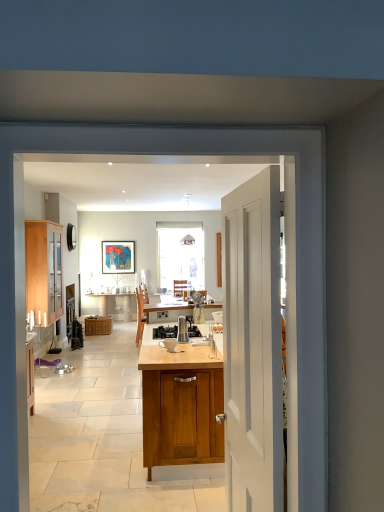
This screenshot has height=512, width=384. What do you see at coordinates (187, 226) in the screenshot?
I see `metallic pendant light at upper center` at bounding box center [187, 226].

The height and width of the screenshot is (512, 384). What do you see at coordinates (44, 271) in the screenshot? I see `light wood/glass cabinet at left` at bounding box center [44, 271].

The width and height of the screenshot is (384, 512). What are the coordinates of `woven brown picnic basket at center` in the screenshot? It's located at (98, 325).

The height and width of the screenshot is (512, 384). Describe the element at coordinates (98, 325) in the screenshot. I see `woven brown picnic basket at center` at that location.

The image size is (384, 512). What do you see at coordinates (182, 330) in the screenshot?
I see `satin silver coffee maker at center` at bounding box center [182, 330].

Describe the element at coordinates (165, 332) in the screenshot. I see `stainless steel gas stove at center` at that location.

The height and width of the screenshot is (512, 384). Identify the location of metallic pendant light at upper center. [x=187, y=226].

Is woven brown picnic basket at center positioned with its back to metallic pendant light at upper center?

woven brown picnic basket at center is not turned away from metallic pendant light at upper center.

In the scene shown: From the image's perspective, which one is positioned lower, woven brown picnic basket at center or metallic pendant light at upper center?

woven brown picnic basket at center is shown below in the image.

Are woven brown picnic basket at center and metallic pendant light at upper center beside each other?

woven brown picnic basket at center is not next to metallic pendant light at upper center, and they're not touching.

Find the location of a particular element. The width and height of the screenshot is (384, 512). kitchen appliance that appears on the right of wooden cabinet at center is located at coordinates (182, 330).

Choose the correct answer: Is wooden cabinet at center inside satin silver coffee maker at center or outside it?

wooden cabinet at center is located beyond the bounds of satin silver coffee maker at center.

Measure the distance from wooden cabinet at center to satin silver coffee maker at center.

The distance of wooden cabinet at center from satin silver coffee maker at center is 9.39 feet.

Who is smaller, wooden cabinet at center or satin silver coffee maker at center?

Smaller between the two is satin silver coffee maker at center.

Considering the positions of objects woven brown picnic basket at center and satin silver coffee maker at center in the image provided, who is more to the right, woven brown picnic basket at center or satin silver coffee maker at center?

From the viewer's perspective, satin silver coffee maker at center appears more on the right side.

From the image's perspective, is woven brown picnic basket at center located above or below satin silver coffee maker at center?

woven brown picnic basket at center is below satin silver coffee maker at center.

Is woven brown picnic basket at center not close to satin silver coffee maker at center?

Indeed, woven brown picnic basket at center is not near satin silver coffee maker at center.

Is woven brown picnic basket at center aimed at satin silver coffee maker at center?

No.

Could you tell me if stainless steel gas stove at center is turned towards metallic pendant light at upper center?

No, stainless steel gas stove at center does not turn towards metallic pendant light at upper center.

Considering the positions of objects stainless steel gas stove at center and metallic pendant light at upper center in the image provided, who is more to the left, stainless steel gas stove at center or metallic pendant light at upper center?

From the viewer's perspective, stainless steel gas stove at center appears more on the left side.

Which object is more forward, stainless steel gas stove at center or metallic pendant light at upper center?

stainless steel gas stove at center is in front.

Where is `lamp on the right of satin silver coffee maker at center`? The image size is (384, 512). lamp on the right of satin silver coffee maker at center is located at coordinates (187, 226).

From a real-world perspective, is satin silver coffee maker at center under metallic pendant light at upper center?

Correct, in the physical world, satin silver coffee maker at center is lower than metallic pendant light at upper center.

Is satin silver coffee maker at center further to camera compared to metallic pendant light at upper center?

No, satin silver coffee maker at center is closer to the viewer.

Considering the points (182, 328) and (187, 214), which point is behind, point (182, 328) or point (187, 214)?

Positioned behind is point (187, 214).

From a real-world perspective, is stainless steel gas stove at center on top of satin silver coffee maker at center?

No.

The height and width of the screenshot is (512, 384). I want to click on gas stove that is below the satin silver coffee maker at center (from the image's perspective), so [165, 332].

Who is shorter, stainless steel gas stove at center or satin silver coffee maker at center?

stainless steel gas stove at center.

Considering the positions of objects stainless steel gas stove at center and satin silver coffee maker at center in the image provided, who is in front, stainless steel gas stove at center or satin silver coffee maker at center?

satin silver coffee maker at center is closer to the camera.

This screenshot has height=512, width=384. What are the coordinates of `residence that is above the stainless steel gas stove at center (from a real-world perspective)` in the screenshot? It's located at (135, 212).

Is stainless steel gas stove at center completely or partially inside wooden cabinet at center?

Actually, stainless steel gas stove at center is outside wooden cabinet at center.

Is point (206, 173) positioned before point (161, 332)?

No, it is not.

Find the location of `lamp above the woven brown picnic basket at center (from the image's perspective)`. lamp above the woven brown picnic basket at center (from the image's perspective) is located at coordinates (187, 226).

Where is `kitchen appliance below the wooden cabinet at center (from the image's perspective)`? This screenshot has height=512, width=384. kitchen appliance below the wooden cabinet at center (from the image's perspective) is located at coordinates click(182, 330).

Which object lies nearer to the anchor point woven brown picnic basket at center, white matte door at center or satin silver coffee maker at center?

Based on the image, satin silver coffee maker at center appears to be nearer to woven brown picnic basket at center.

Looking at the image, which one is located closer to woven brown picnic basket at center, white matte door at center or stainless steel gas stove at center?

stainless steel gas stove at center lies closer to woven brown picnic basket at center than the other object.

When comparing their distances from woven brown picnic basket at center, does metallic pendant light at upper center or stainless steel gas stove at center seem further?

stainless steel gas stove at center is positioned further to the anchor woven brown picnic basket at center.

Looking at the image, which one is located further to woven brown picnic basket at center, stainless steel gas stove at center or light wood/glass cabinet at left?

stainless steel gas stove at center.

Estimate the real-world distances between objects in this image. Which object is further from light wood/glass cabinet at left, wooden cabinet at center or stainless steel gas stove at center?

Among the two, stainless steel gas stove at center is located further to light wood/glass cabinet at left.

Which object lies nearer to the anchor point satin silver coffee maker at center, woven brown picnic basket at center or white matte door at center?

white matte door at center is positioned closer to the anchor satin silver coffee maker at center.

From the image, which object appears to be farther from wooden cabinet at center, stainless steel gas stove at center or white matte door at center?

stainless steel gas stove at center is positioned further to the anchor wooden cabinet at center.

Based on their spatial positions, is woven brown picnic basket at center or satin silver coffee maker at center further from wooden cabinet at center?

satin silver coffee maker at center is further to wooden cabinet at center.

At what (x,y) coordinates should I click in order to perform the action: click on gas stove located between wooden cabinet at center and metallic pendant light at upper center in the depth direction. Please return your answer as a coordinate pair (x, y). This screenshot has height=512, width=384. Looking at the image, I should click on (165, 332).

Where is `door between wooden cabinet at center and woven brown picnic basket at center from front to back`? The image size is (384, 512). door between wooden cabinet at center and woven brown picnic basket at center from front to back is located at coordinates (253, 344).

Where is `gas stove between white matte door at center and metallic pendant light at upper center in the front-back direction`? The image size is (384, 512). gas stove between white matte door at center and metallic pendant light at upper center in the front-back direction is located at coordinates (165, 332).

Locate an element on the screen. kitchen appliance between white matte door at center and stainless steel gas stove at center in the front-back direction is located at coordinates (182, 330).